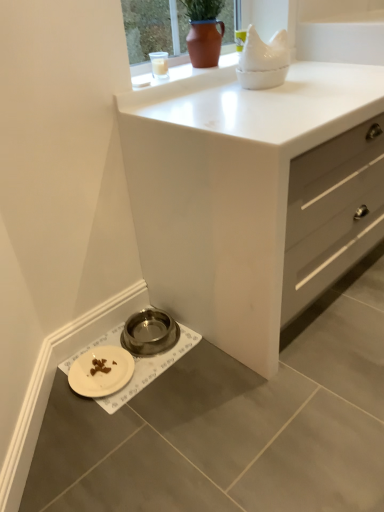
The image size is (384, 512). I want to click on vacant region to the right of white matte plate at lower left, so click(152, 369).